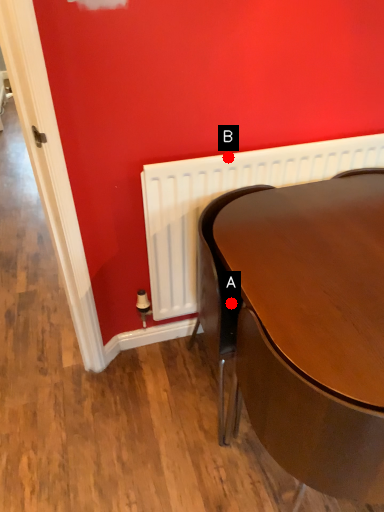
Question: Two points are circled on the image, labeled by A and B beside each circle. Among these points, which one is farthest from the camera?

Choices:
 (A) A is further
 (B) B is further

Answer: (B)